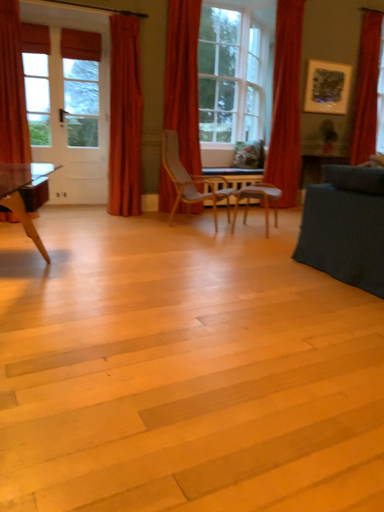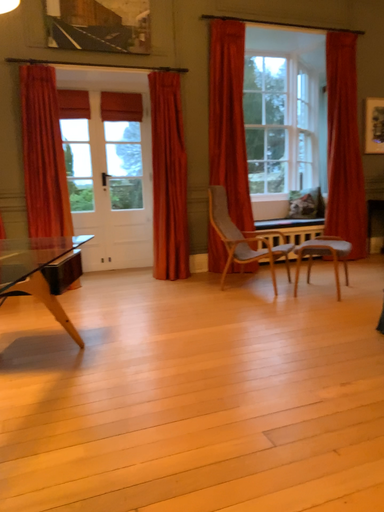
Question: How did the camera likely rotate when shooting the video?

Choices:
 (A) rotated downward
 (B) rotated upward

Answer: (B)